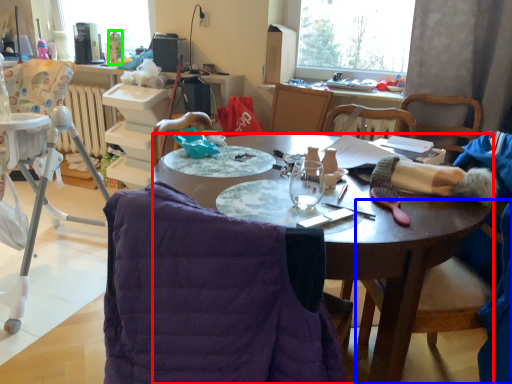
Question: Which is farther away from desk (highlighted by a red box)? chair (highlighted by a blue box) or bottle (highlighted by a green box)?

Choices:
 (A) chair
 (B) bottle

Answer: (B)